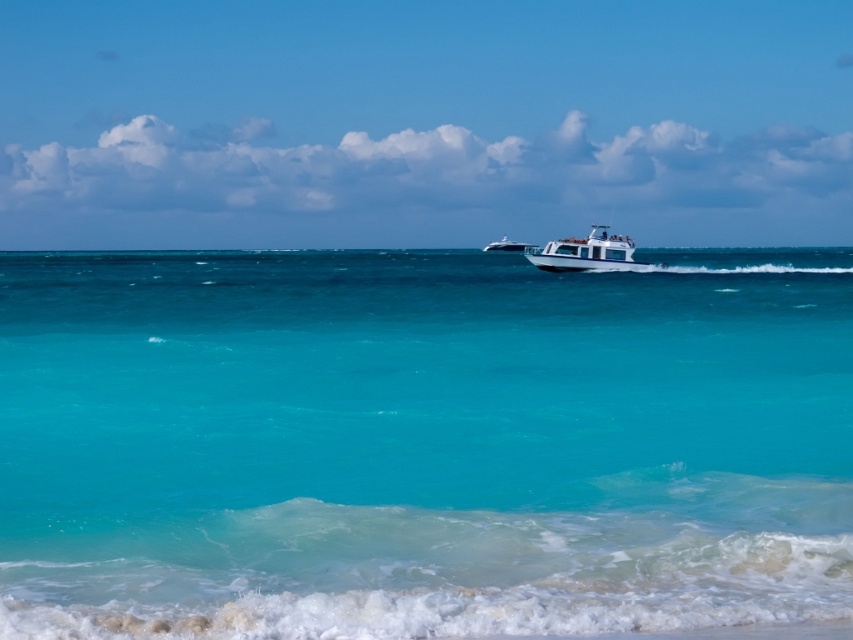
Question: Is turquoise glossy water at center bigger than white glossy boat at center?

Choices:
 (A) yes
 (B) no

Answer: (A)

Question: Which point appears closest to the camera in this image?

Choices:
 (A) click(599, 259)
 (B) click(494, 250)

Answer: (A)

Question: Among these points, which one is farthest from the camera?

Choices:
 (A) (170, 292)
 (B) (494, 244)
 (C) (585, 257)

Answer: (B)

Question: Does turquoise glossy water at center have a smaller size compared to white glossy yacht at center?

Choices:
 (A) yes
 (B) no

Answer: (B)

Question: Where is white glossy boat at center located in relation to white glossy yacht at center in the image?

Choices:
 (A) below
 (B) above

Answer: (A)

Question: Which point is closer to the camera?

Choices:
 (A) white glossy yacht at center
 (B) turquoise glossy water at center
 (C) white glossy boat at center

Answer: (B)